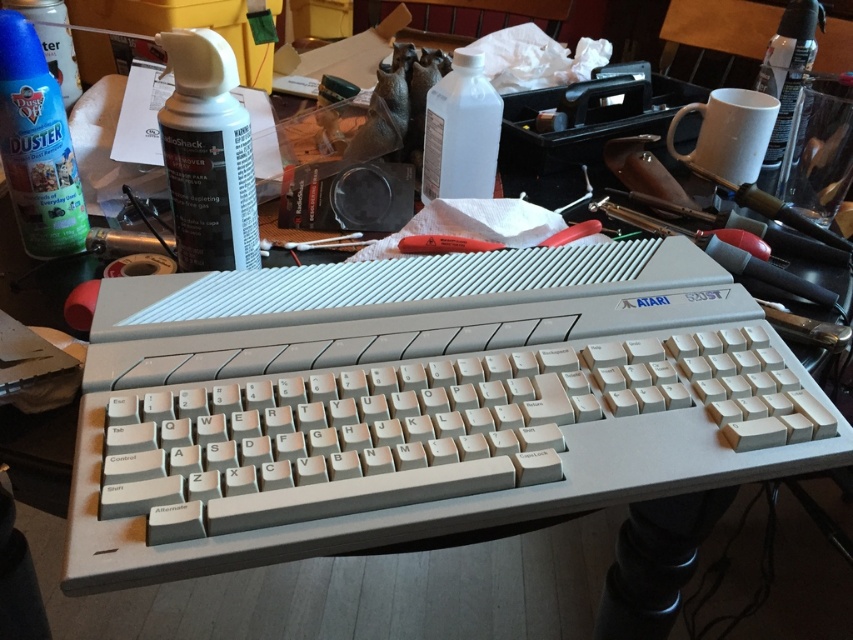
You are organizing the desk and need to place the blue plastic duster at upper left and the clear plastic spray can at upper right into a drawer. The drawer has a width of 10 cm. Which item will fit better in the drawer based on their thickness?

The blue plastic duster at upper left is thinner than the clear plastic spray can at upper right, so the blue plastic duster at upper left will fit better in the drawer.

You are a technician trying to locate two specific points on the desk. The first point is at coordinate point(177,177) and the second is at point(434,129). From your vantage point, which point is closer to you?

Point(177,177) is in front of point(434,129), so the first point is closer to you.